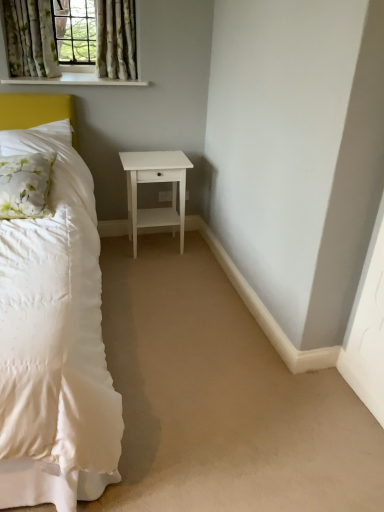
Question: Is floral fabric curtain at upper left, which is the 2th curtain in left-to-right order, completely or partially outside of floral fabric curtain at upper left?

Choices:
 (A) no
 (B) yes

Answer: (A)

Question: From a real-world perspective, is floral fabric curtain at upper left, the 1th curtain in the right-to-left sequence, over floral fabric curtain at upper left?

Choices:
 (A) yes
 (B) no

Answer: (A)

Question: From a real-world perspective, is floral fabric curtain at upper left, which is the 2th curtain in left-to-right order, located beneath floral fabric curtain at upper left?

Choices:
 (A) yes
 (B) no

Answer: (B)

Question: Is floral fabric curtain at upper left, the 1th curtain in the right-to-left sequence, at the left side of floral fabric curtain at upper left?

Choices:
 (A) no
 (B) yes

Answer: (A)

Question: Could you tell me if floral fabric curtain at upper left, the 1th curtain in the right-to-left sequence, is facing floral fabric curtain at upper left?

Choices:
 (A) no
 (B) yes

Answer: (B)

Question: Can you confirm if floral fabric curtain at upper left, the 1th curtain in the right-to-left sequence, is smaller than floral fabric curtain at upper left?

Choices:
 (A) yes
 (B) no

Answer: (A)

Question: Does white matte nightstand at center touch white painted wood at upper left?

Choices:
 (A) yes
 (B) no

Answer: (B)

Question: Can we say white matte nightstand at center lies outside white painted wood at upper left?

Choices:
 (A) no
 (B) yes

Answer: (B)

Question: Is white matte nightstand at center further to camera compared to white painted wood at upper left?

Choices:
 (A) yes
 (B) no

Answer: (A)

Question: Does white matte nightstand at center contain white painted wood at upper left?

Choices:
 (A) no
 (B) yes

Answer: (A)

Question: Is white matte nightstand at center at the right side of white painted wood at upper left?

Choices:
 (A) no
 (B) yes

Answer: (B)

Question: Can you confirm if white matte nightstand at center is wider than white painted wood at upper left?

Choices:
 (A) yes
 (B) no

Answer: (A)

Question: Does white floral fabric pillow at left have a greater height compared to white plastic electric outlet at center?

Choices:
 (A) no
 (B) yes

Answer: (B)